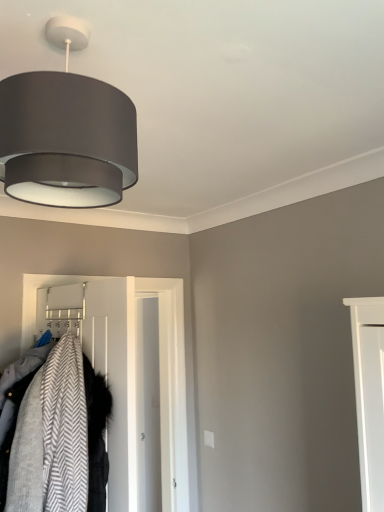
Question: Can we say gray herringbone fabric coat at left lies outside matte gray fabric lampshade at upper left?

Choices:
 (A) no
 (B) yes

Answer: (B)

Question: Is gray herringbone fabric coat at left bigger than matte gray fabric lampshade at upper left?

Choices:
 (A) no
 (B) yes

Answer: (B)

Question: Can you confirm if gray herringbone fabric coat at left is positioned to the right of matte gray fabric lampshade at upper left?

Choices:
 (A) yes
 (B) no

Answer: (B)

Question: Is gray herringbone fabric coat at left oriented towards matte gray fabric lampshade at upper left?

Choices:
 (A) no
 (B) yes

Answer: (A)

Question: Can you confirm if gray herringbone fabric coat at left is shorter than matte gray fabric lampshade at upper left?

Choices:
 (A) yes
 (B) no

Answer: (B)

Question: From the image's perspective, relative to gray herringbone fabric coat at left, is white plastic hanger at center above or below?

Choices:
 (A) above
 (B) below

Answer: (B)

Question: Considering the positions of white plastic hanger at center and gray herringbone fabric coat at left in the image, is white plastic hanger at center wider or thinner than gray herringbone fabric coat at left?

Choices:
 (A) wide
 (B) thin

Answer: (B)

Question: Is white plastic hanger at center to the left or to the right of gray herringbone fabric coat at left in the image?

Choices:
 (A) right
 (B) left

Answer: (A)

Question: Which is correct: white plastic hanger at center is inside gray herringbone fabric coat at left, or outside of it?

Choices:
 (A) outside
 (B) inside

Answer: (A)

Question: Is gray herringbone fabric coat at left bigger or smaller than white smooth door at center?

Choices:
 (A) big
 (B) small

Answer: (B)

Question: Is gray herringbone fabric coat at left spatially inside white smooth door at center, or outside of it?

Choices:
 (A) outside
 (B) inside

Answer: (A)

Question: Considering their positions, is gray herringbone fabric coat at left located in front of or behind white smooth door at center?

Choices:
 (A) behind
 (B) front

Answer: (B)

Question: Looking at their shapes, would you say gray herringbone fabric coat at left is wider or thinner than white smooth door at center?

Choices:
 (A) thin
 (B) wide

Answer: (B)

Question: Do you think gray herringbone fabric coat at left is within matte gray fabric lampshade at upper left, or outside of it?

Choices:
 (A) inside
 (B) outside

Answer: (B)

Question: From their relative heights in the image, would you say gray herringbone fabric coat at left is taller or shorter than matte gray fabric lampshade at upper left?

Choices:
 (A) tall
 (B) short

Answer: (A)